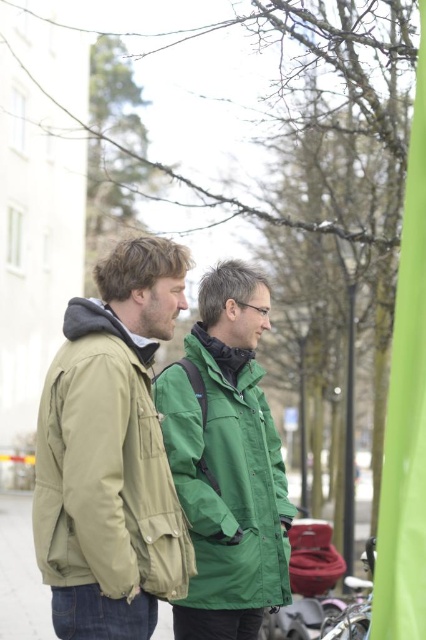
You are a photographer trying to capture a shot of both the olive green jacket at left and the green matte jacket at center. Since you want them both in the frame, which direction should you move your camera to include both?

You should move your camera to the left to include both the olive green jacket at left and the green matte jacket at center because the olive green jacket at left is positioned to the left of the green matte jacket at center.

You are standing on the sidewalk and see the matte green jacket at center. If you want to reach it in 3 seconds, what is the minimum speed you need to move towards it?

The matte green jacket at center is 11.77 feet away from viewer. To reach it in 3 seconds, you need to move at a minimum speed of approximately 3.92 feet per second.

You are a tailor measuring jackets for a fitting session. You have a customer who wants to know which jacket between the matte green jacket at center and the olive green jacket at left is narrower. Which one should you recommend?

The matte green jacket at center is narrower than the olive green jacket at left, so you should recommend the matte green jacket at center.